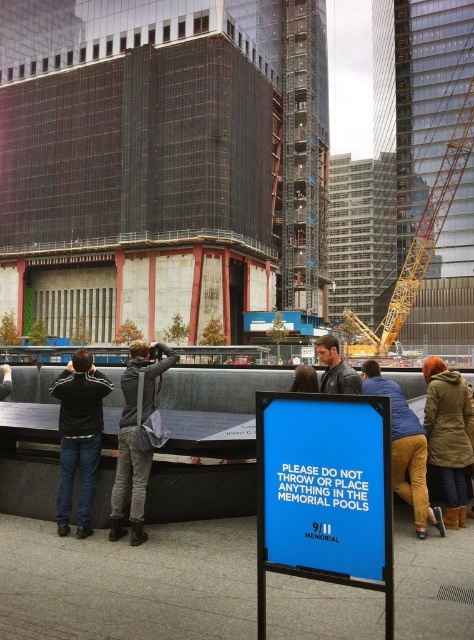
You are standing at the 9 memorial and see a concrete wall at center and a leather jacket at center. Which object is positioned to the left?

The concrete wall at center is to the left of the leather jacket at center.

You are a photographer standing at the 9 Memorial and want to capture a person wearing both the black matte jacket at left and the gray jeans at center in the same frame. Based on their heights, which clothing item will appear larger in your photo?

The black matte jacket at left will appear larger in the photo since it is much taller than the gray jeans at center.